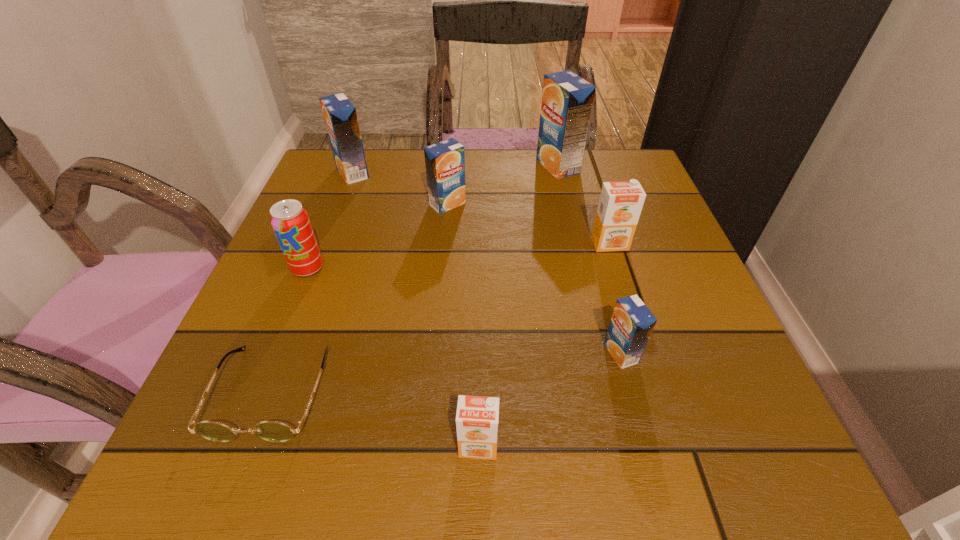
Where is `free space that satisfies the following two spatial constraints: 1. on the front side of the third farthest orange juice; 2. on the right side of the nearer orange orange juice`? The image size is (960, 540). free space that satisfies the following two spatial constraints: 1. on the front side of the third farthest orange juice; 2. on the right side of the nearer orange orange juice is located at coordinates (426, 446).

Identify the location of free space in the image that satisfies the following two spatial constraints: 1. on the front side of the fifth farthest orange juice; 2. on the right side of the tallest object. The width and height of the screenshot is (960, 540). (602, 353).

You are a GUI agent. You are given a task and a screenshot of the screen. Output one action in this format:
    pyautogui.click(x=<x>, y=<y>)
    Task: Click on the vacant position in the image that satisfies the following two spatial constraints: 1. on the front side of the fifth orange juice from right to left; 2. on the right side of the seventh shortest object
    Image resolution: width=960 pixels, height=540 pixels.
    Given the screenshot: What is the action you would take?
    pyautogui.click(x=341, y=204)